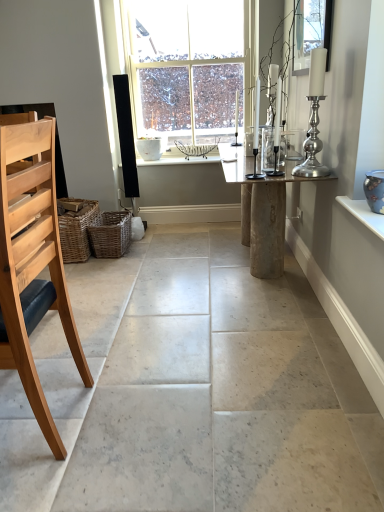
The width and height of the screenshot is (384, 512). Find the location of `vacant point to the right of natural wood chair at left`. vacant point to the right of natural wood chair at left is located at coordinates (126, 420).